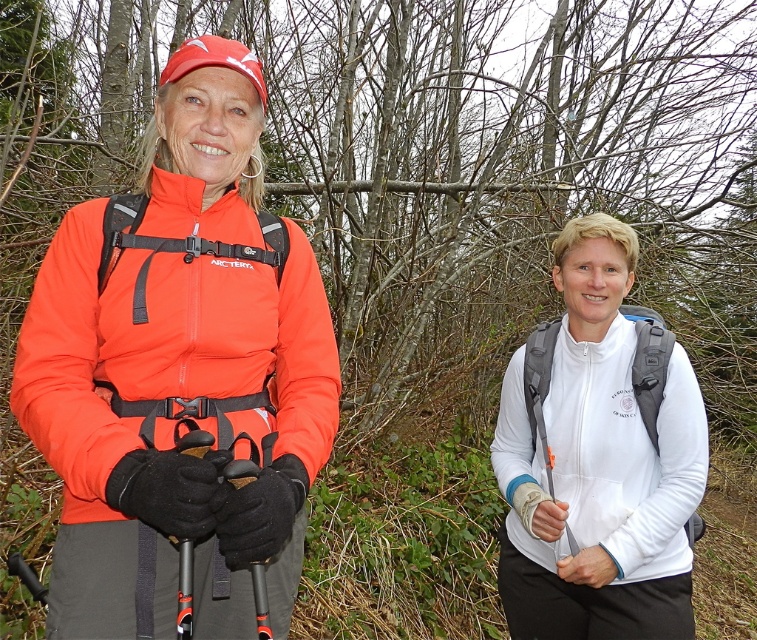
Question: Which object is the farthest from the white matte jacket at right?

Choices:
 (A) black rubber ski pole at center
 (B) matte orange jacket at left

Answer: (A)

Question: Where is white matte jacket at right located in relation to black rubber ski pole at center in the image?

Choices:
 (A) above
 (B) below

Answer: (A)

Question: Can you confirm if white matte jacket at right is positioned to the left of black rubber ski pole at center?

Choices:
 (A) no
 (B) yes

Answer: (A)

Question: Which of the following is the farthest from the observer?

Choices:
 (A) black rubber ski pole at center
 (B) matte orange jacket at left

Answer: (B)

Question: Can you confirm if white matte jacket at right is positioned above black rubber ski pole at center?

Choices:
 (A) no
 (B) yes

Answer: (B)

Question: Which of the following is the closest to the observer?

Choices:
 (A) (559, 337)
 (B) (51, 349)
 (C) (189, 547)

Answer: (C)